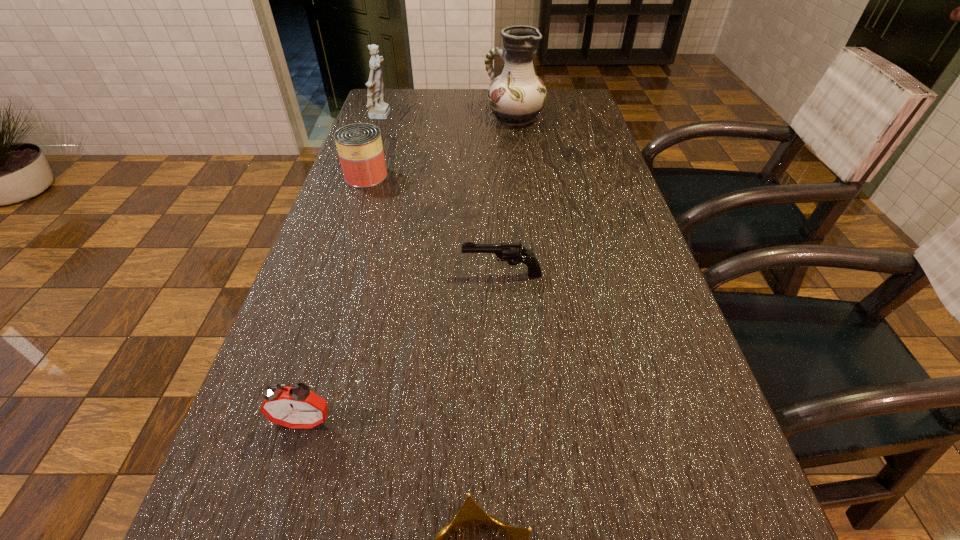
The height and width of the screenshot is (540, 960). In order to click on vacant space located 0.260m at the end of the barrel of the gun in this screenshot , I will do `click(342, 274)`.

This screenshot has height=540, width=960. Find the location of `vacant region located 0.330m at the end of the barrel of the gun`. vacant region located 0.330m at the end of the barrel of the gun is located at coordinates (310, 274).

Locate an element on the screen. The height and width of the screenshot is (540, 960). vase present at the far edge is located at coordinates (516, 96).

Where is `figurine that is at the far edge`? This screenshot has height=540, width=960. figurine that is at the far edge is located at coordinates [x=377, y=109].

You are a GUI agent. You are given a task and a screenshot of the screen. Output one action in this format:
    pyautogui.click(x=<x>, y=<y>)
    Task: Click on the figurine located at the left edge
    
    Given the screenshot: What is the action you would take?
    pyautogui.click(x=377, y=109)

Identify the location of can at the left edge. coord(359,145).

The width and height of the screenshot is (960, 540). What are the coordinates of `alarm clock at the left edge` in the screenshot? It's located at (296, 406).

Where is `object that is at the far left corner`? object that is at the far left corner is located at coordinates (377, 109).

Where is `free region at the far edge of the desktop`? free region at the far edge of the desktop is located at coordinates (487, 118).

You are a GUI agent. You are given a task and a screenshot of the screen. Output one action in this format:
    pyautogui.click(x=<x>, y=<y>)
    Task: Click on the vacant area at the left edge
    
    Given the screenshot: What is the action you would take?
    pyautogui.click(x=388, y=136)